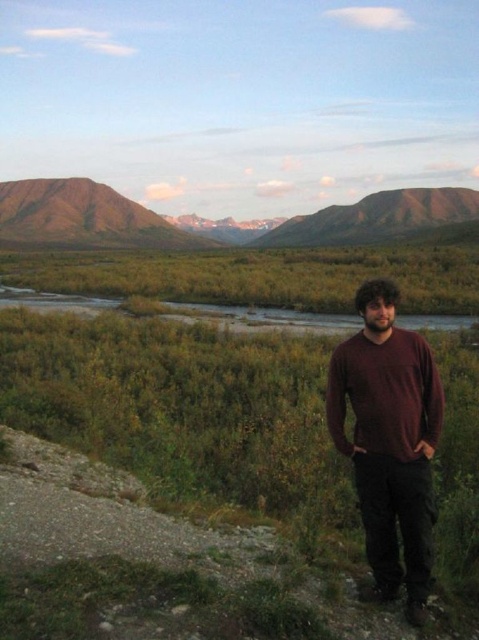
Question: Which object is closer to the camera taking this photo?

Choices:
 (A) green grassy wetland at center
 (B) brown rocky mountain at upper center
 (C) green grassy river at center

Answer: (A)

Question: Can you confirm if maroon sweater at center is thinner than rugged brown mountain at upper left?

Choices:
 (A) no
 (B) yes

Answer: (B)

Question: Does maroon sweater at center come in front of green grassy river at center?

Choices:
 (A) no
 (B) yes

Answer: (B)

Question: Does brown rocky mountain at upper center have a smaller size compared to green grassy river at center?

Choices:
 (A) yes
 (B) no

Answer: (B)

Question: Which point is closer to the camera?

Choices:
 (A) rugged brown mountain at upper left
 (B) brown rocky mountain at upper center
 (C) green grassy wetland at center

Answer: (C)

Question: Which object appears farthest from the camera in this image?

Choices:
 (A) green grassy river at center
 (B) green grassy wetland at center

Answer: (A)